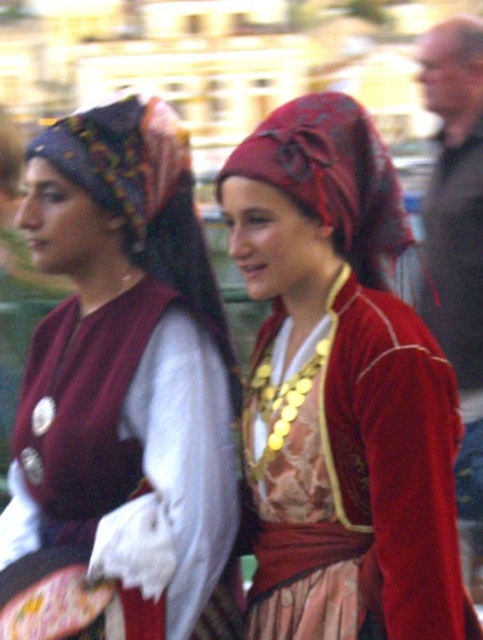
Which is below, matte black headscarf at left or matte red fabric headscarf at center?

matte black headscarf at left is lower down.

Does point (90, 131) come closer to viewer compared to point (367, 180)?

Yes.

Does point (118, 460) come closer to viewer compared to point (400, 486)?

No, (118, 460) is behind (400, 486).

Find the location of a particular element. The height and width of the screenshot is (640, 483). matte black headscarf at left is located at coordinates (123, 392).

Can you confirm if matte red fabric headscarf at center is smaller than velvet-like red headscarf at center?

No, matte red fabric headscarf at center is not smaller than velvet-like red headscarf at center.

Between matte red fabric headscarf at center and velvet-like red headscarf at center, which one is positioned lower?

matte red fabric headscarf at center

The image size is (483, 640). I want to click on matte red fabric headscarf at center, so click(x=340, y=392).

You are a GUI agent. You are given a task and a screenshot of the screen. Output one action in this format:
    pyautogui.click(x=<x>, y=<y>)
    Task: Click on the matte red fabric headscarf at center
    The image size is (483, 640).
    Given the screenshot: What is the action you would take?
    pyautogui.click(x=340, y=392)

Identify the location of matte black headscarf at left. This screenshot has width=483, height=640. (123, 392).

Does point (85, 369) come in front of point (381, 204)?

Yes, point (85, 369) is in front of point (381, 204).

I want to click on matte black headscarf at left, so click(x=123, y=392).